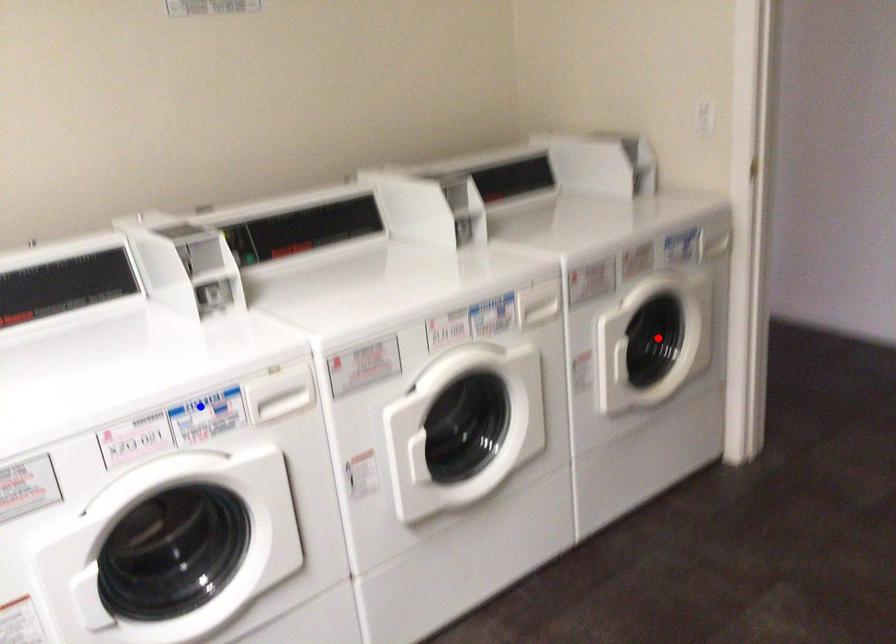
Question: Two points are marked on the image. Which point is closer to the camera?

Choices:
 (A) Blue point is closer.
 (B) Red point is closer.

Answer: (A)